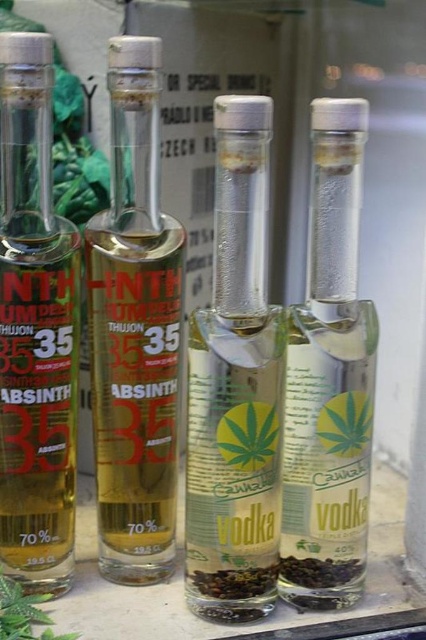
Is translucent glass absinth at left in front of transparent glass vodka at right?

Yes, it is in front of transparent glass vodka at right.

Is translucent glass absinth at left above transparent glass vodka at right?

Indeed, translucent glass absinth at left is positioned over transparent glass vodka at right.

Who is more distant from viewer, (6, 348) or (348, 468)?

The point (348, 468) is behind.

Identify the location of translucent glass absinth at left. This screenshot has width=426, height=640. (34, 330).

Does transparent glass vodka at center appear on the right side of green leafy parsley at lower left?

Indeed, transparent glass vodka at center is positioned on the right side of green leafy parsley at lower left.

Measure the distance from transparent glass vodka at center to green leafy parsley at lower left.

They are 34.80 centimeters apart.

Where is `transparent glass vodka at center`? This screenshot has height=640, width=426. transparent glass vodka at center is located at coordinates (236, 387).

Find the location of a particular element. The width and height of the screenshot is (426, 640). transparent glass vodka at center is located at coordinates (236, 387).

Who is more distant from viewer, (118, 552) or (344, 513)?

The point (118, 552) is more distant.

Does clear glass absinth at center have a lesser width compared to transparent glass vodka at right?

Incorrect, clear glass absinth at center's width is not less than transparent glass vodka at right's.

You are a GUI agent. You are given a task and a screenshot of the screen. Output one action in this format:
    pyautogui.click(x=<x>, y=<y>)
    Task: Click on the clear glass absinth at center
    
    Given the screenshot: What is the action you would take?
    pyautogui.click(x=135, y=330)